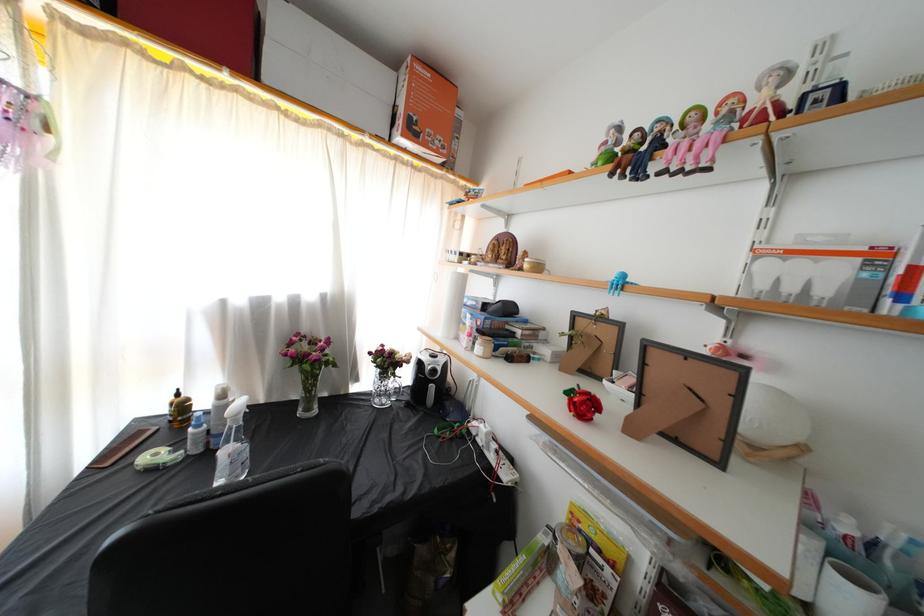
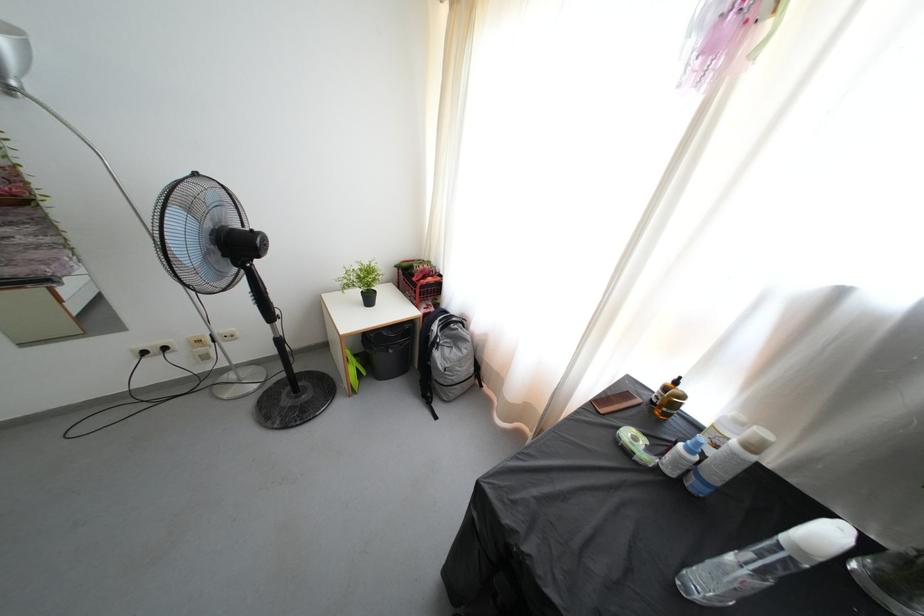
Locate, in the second image, the point that corresponds to (x=224, y=458) in the first image.

(736, 564)